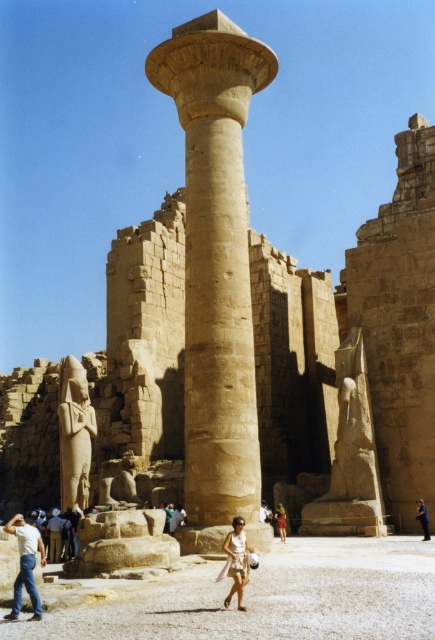
Who is shorter, denim jeans at lower left or light brown stone statue at lower left?

Standing shorter between the two is light brown stone statue at lower left.

Between point (10, 611) and point (59, 529), which one is positioned behind?

Point (59, 529)

At what (x,y) coordinates should I click in order to perform the action: click on denim jeans at lower left. Please return your answer as a coordinate pair (x, y). This screenshot has height=640, width=435. Looking at the image, I should click on (26, 564).

Between point (64, 465) and point (283, 536), which one is positioned in front?

Point (283, 536) is in front.

Who is lower down, smooth beige statue at lower left or light brown fabric dress at center?

light brown fabric dress at center is lower down.

Locate an element on the screen. Image resolution: width=435 pixels, height=640 pixels. smooth beige statue at lower left is located at coordinates (74, 433).

Who is lower down, tan fabric shorts at center or light brown fabric dress at center?

light brown fabric dress at center is lower down.

Can you confirm if tan fabric shorts at center is bigger than light brown fabric dress at center?

Correct, tan fabric shorts at center is larger in size than light brown fabric dress at center.

Where is `tan fabric shorts at center`? tan fabric shorts at center is located at coordinates [237, 561].